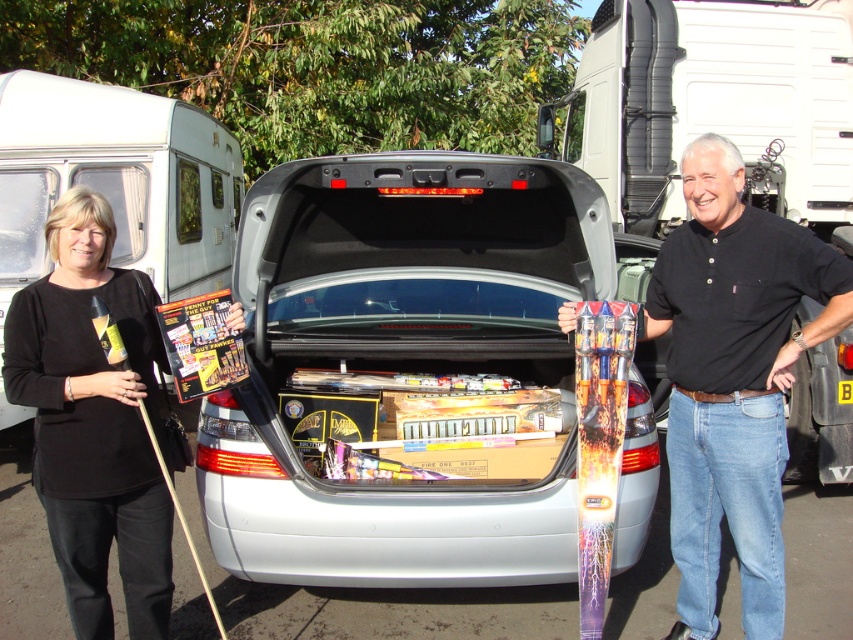
You are standing in the parking lot and need to place a heavy box into the trunk of the silver metallic car trunk at center. The box is too large to carry around the car. Can you move the box directly from where you are to the trunk without going around the car, considering the position of the black cotton shirt at center?

The silver metallic car trunk at center is to the left of the black cotton shirt at center, so if you are positioned near the black cotton shirt at center, you can move the box directly to the trunk without needing to go around the car since the trunk is adjacent to your left side.

You are a delivery person who needs to unload a package from the white glossy van at upper left and place it into the metallic silver car trunk at center. Based on the scene, can you determine if the trunk is accessible for loading?

The white glossy van at upper left is to the left of the metallic silver car trunk at center, so the trunk is accessible for loading as it is positioned in front of the van.

You are standing in front of the silver car trunk with items. You need to hand a pamphlet to the person wearing the black cotton shirt at center. Can you reach them without moving closer?

The black cotton shirt at center is 9.96 feet away from the viewer. Since this distance is greater than an average arm length of about 2.5 feet, you cannot reach them without moving closer.